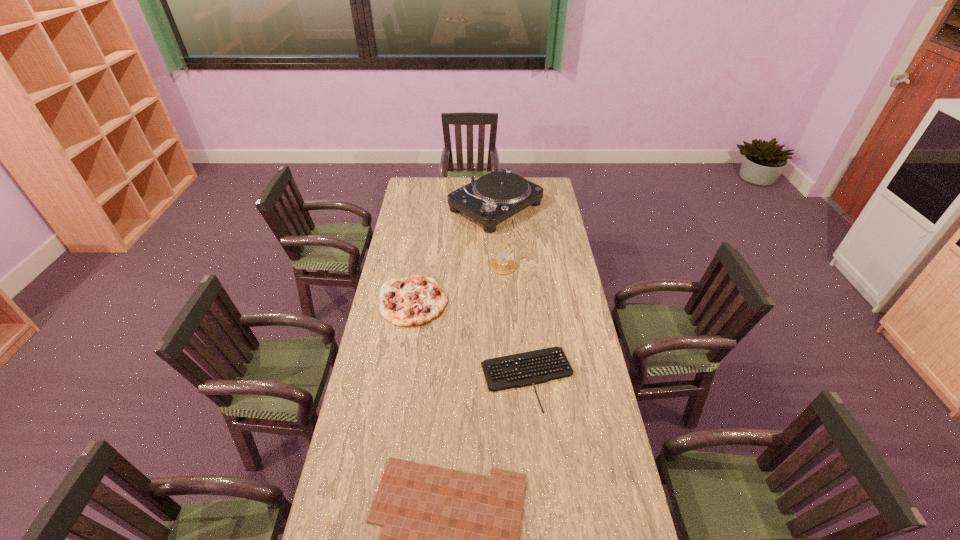
Locate an element on the screen. The height and width of the screenshot is (540, 960). free space between the second tallest object and the farthest object is located at coordinates (499, 237).

The height and width of the screenshot is (540, 960). I want to click on free point between the record player and the third farthest object, so click(455, 254).

Where is `free space between the third farthest object and the tallest object`? This screenshot has width=960, height=540. free space between the third farthest object and the tallest object is located at coordinates (455, 254).

Identify the location of vacant space in between the cup and the farthest object. Image resolution: width=960 pixels, height=540 pixels. pos(499,237).

This screenshot has width=960, height=540. What are the coordinates of `free space between the computer keyboard and the farthest object` in the screenshot? It's located at (512, 293).

Where is `the second closest object to the second shortest object`? the second closest object to the second shortest object is located at coordinates (412, 301).

Identify the location of object that is the second closest to the second tallest object. (412, 301).

I want to click on vacant space that satisfies the following two spatial constraints: 1. with the handle on the side of the computer keyboard; 2. on the left side of the second tallest object, so click(510, 378).

The image size is (960, 540). What are the coordinates of `free point that satisfies the following two spatial constraints: 1. on the front side of the third tallest object; 2. on the right side of the second shortest object` in the screenshot? It's located at (401, 378).